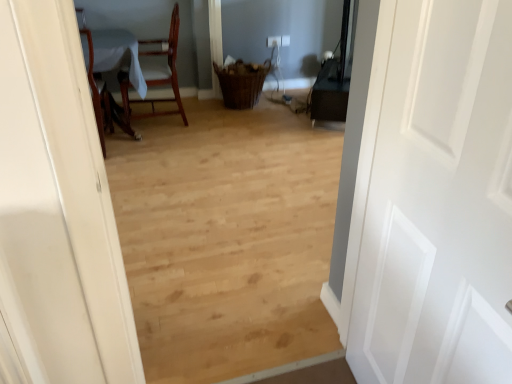
Question: Is wooden table at left shorter than white matte door at right?

Choices:
 (A) no
 (B) yes

Answer: (B)

Question: Is wooden table at left oriented away from white matte door at right?

Choices:
 (A) no
 (B) yes

Answer: (A)

Question: Is wooden table at left positioned behind white matte door at right?

Choices:
 (A) yes
 (B) no

Answer: (A)

Question: Does wooden table at left have a lesser width compared to white matte door at right?

Choices:
 (A) yes
 (B) no

Answer: (B)

Question: Is wooden table at left to the right of white matte door at right from the viewer's perspective?

Choices:
 (A) yes
 (B) no

Answer: (B)

Question: Is wooden table at left taller than white matte door at right?

Choices:
 (A) yes
 (B) no

Answer: (B)

Question: Is white matte door at right positioned far away from wooden table at left?

Choices:
 (A) no
 (B) yes

Answer: (B)

Question: Considering the relative positions of white matte door at right and wooden table at left in the image provided, is white matte door at right to the right of wooden table at left from the viewer's perspective?

Choices:
 (A) no
 (B) yes

Answer: (B)

Question: Is white matte door at right surrounding wooden table at left?

Choices:
 (A) no
 (B) yes

Answer: (A)

Question: From the image's perspective, is white matte door at right over wooden table at left?

Choices:
 (A) no
 (B) yes

Answer: (A)

Question: From the image's perspective, is white matte door at right under wooden table at left?

Choices:
 (A) no
 (B) yes

Answer: (B)

Question: Is white matte door at right smaller than wooden table at left?

Choices:
 (A) no
 (B) yes

Answer: (B)

Question: Can you confirm if wooden table at left is positioned to the left of mahogany wood chair at upper left?

Choices:
 (A) yes
 (B) no

Answer: (A)